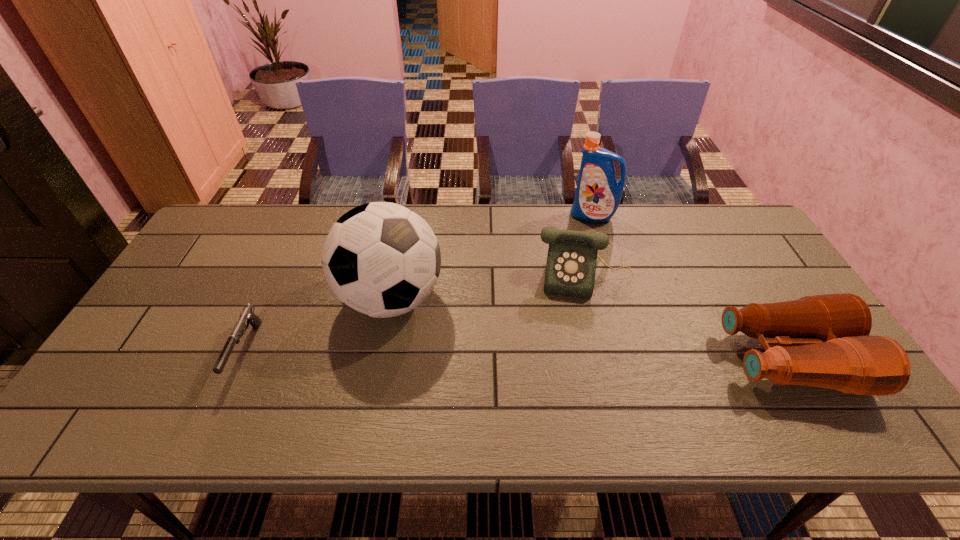
Identify the location of the shortest object. The image size is (960, 540). [x=247, y=315].

I want to click on the leftmost object, so click(x=247, y=315).

Identify the location of binoculars. (837, 352).

Identify the location of the farthest object. 598,194.

Identify the location of the fourth object from right to left. (380, 259).

The image size is (960, 540). In order to click on telephone in this screenshot , I will do pyautogui.click(x=572, y=255).

Identify the location of vacant point located 0.300m on the label of the farthest object. (551, 280).

Identify the location of free spot located 0.320m on the label of the farthest object. The width and height of the screenshot is (960, 540). (549, 285).

The height and width of the screenshot is (540, 960). Find the location of `vacant space situated 0.210m on the label of the farthest object`. vacant space situated 0.210m on the label of the farthest object is located at coordinates (563, 261).

Identify the location of free region located on the main logo of the soccer ball. (488, 349).